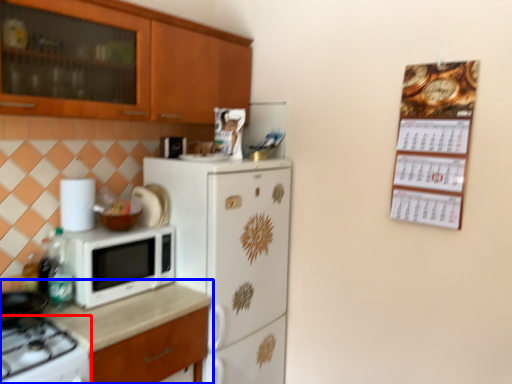
Question: Which object is closer to the camera taking this photo, gas stove (highlighted by a red box) or countertop (highlighted by a blue box)?

Choices:
 (A) gas stove
 (B) countertop

Answer: (A)